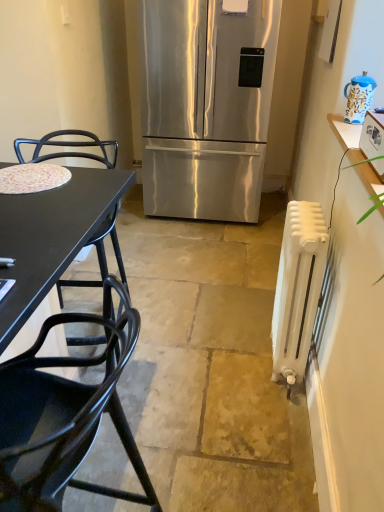
Where is `vacant area that lies between white matte radiator at right and black metal chair at left, which appears as the second chair when viewed from the front`? Image resolution: width=384 pixels, height=512 pixels. vacant area that lies between white matte radiator at right and black metal chair at left, which appears as the second chair when viewed from the front is located at coordinates (198, 348).